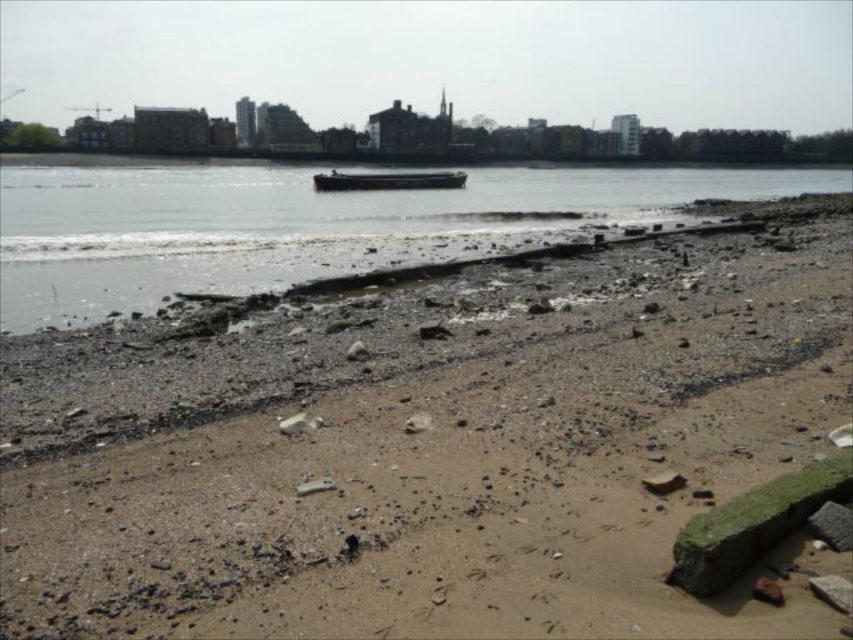
Is smooth water at center to the left of dark gray metallic barge at center from the viewer's perspective?

Correct, you'll find smooth water at center to the left of dark gray metallic barge at center.

Between point (136, 170) and point (341, 186), which one is positioned in front?

Point (341, 186) is in front.

The image size is (853, 640). Describe the element at coordinates (300, 225) in the screenshot. I see `smooth water at center` at that location.

This screenshot has width=853, height=640. In order to click on smooth water at center in this screenshot , I will do `click(300, 225)`.

Consider the image. Does brown sandy beach at lower center have a greater height compared to smooth water at center?

In fact, brown sandy beach at lower center may be shorter than smooth water at center.

Find the location of a particular element. The image size is (853, 640). brown sandy beach at lower center is located at coordinates (428, 449).

Is point (486, 284) closer to viewer compared to point (409, 234)?

Yes, it is in front of point (409, 234).

Where is `brown sandy beach at lower center`? The height and width of the screenshot is (640, 853). brown sandy beach at lower center is located at coordinates (428, 449).

Does brown sandy beach at lower center come in front of dark gray metallic barge at center?

Yes, it is.

Is point (265, 371) behind point (376, 189)?

No.

Find the location of a particular element. brown sandy beach at lower center is located at coordinates (428, 449).